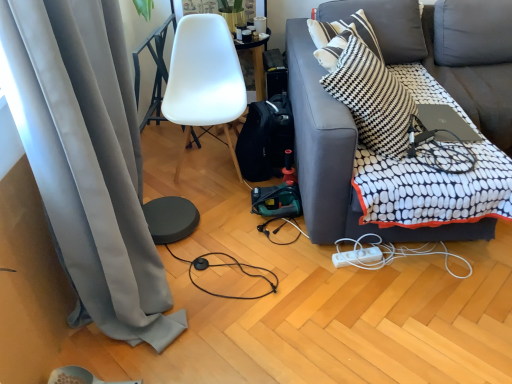
Question: Is black fabric backpack at center oriented towards white matte chair at center?

Choices:
 (A) no
 (B) yes

Answer: (A)

Question: Considering the relative sizes of black fabric backpack at center and white matte chair at center in the image provided, is black fabric backpack at center bigger than white matte chair at center?

Choices:
 (A) no
 (B) yes

Answer: (A)

Question: Can you confirm if black fabric backpack at center is shorter than white matte chair at center?

Choices:
 (A) yes
 (B) no

Answer: (A)

Question: Is white matte chair at center a part of black fabric backpack at center?

Choices:
 (A) yes
 (B) no

Answer: (B)

Question: Is black fabric backpack at center facing away from white matte chair at center?

Choices:
 (A) no
 (B) yes

Answer: (A)

Question: Is silver metallic laptop at upper right bigger or smaller than gray fabric curtain at left?

Choices:
 (A) big
 (B) small

Answer: (B)

Question: Choose the correct answer: Is silver metallic laptop at upper right inside gray fabric curtain at left or outside it?

Choices:
 (A) outside
 (B) inside

Answer: (A)

Question: From the image's perspective, is silver metallic laptop at upper right above or below gray fabric curtain at left?

Choices:
 (A) above
 (B) below

Answer: (A)

Question: Is silver metallic laptop at upper right in front of or behind gray fabric curtain at left in the image?

Choices:
 (A) front
 (B) behind

Answer: (B)

Question: Is white plastic power strip at lower right taller or shorter than black and white checkered pillow at upper right?

Choices:
 (A) short
 (B) tall

Answer: (A)

Question: From a real-world perspective, is white plastic power strip at lower right above or below black and white checkered pillow at upper right?

Choices:
 (A) below
 (B) above

Answer: (A)

Question: In the image, is white plastic power strip at lower right on the left side or the right side of black and white checkered pillow at upper right?

Choices:
 (A) left
 (B) right

Answer: (B)

Question: In terms of size, does white plastic power strip at lower right appear bigger or smaller than black and white checkered pillow at upper right?

Choices:
 (A) small
 (B) big

Answer: (A)

Question: Would you say white matte chair at center is to the left or to the right of dark gray fabric couch at right in the picture?

Choices:
 (A) right
 (B) left

Answer: (B)

Question: In the image, is white matte chair at center positioned in front of or behind dark gray fabric couch at right?

Choices:
 (A) behind
 (B) front

Answer: (A)